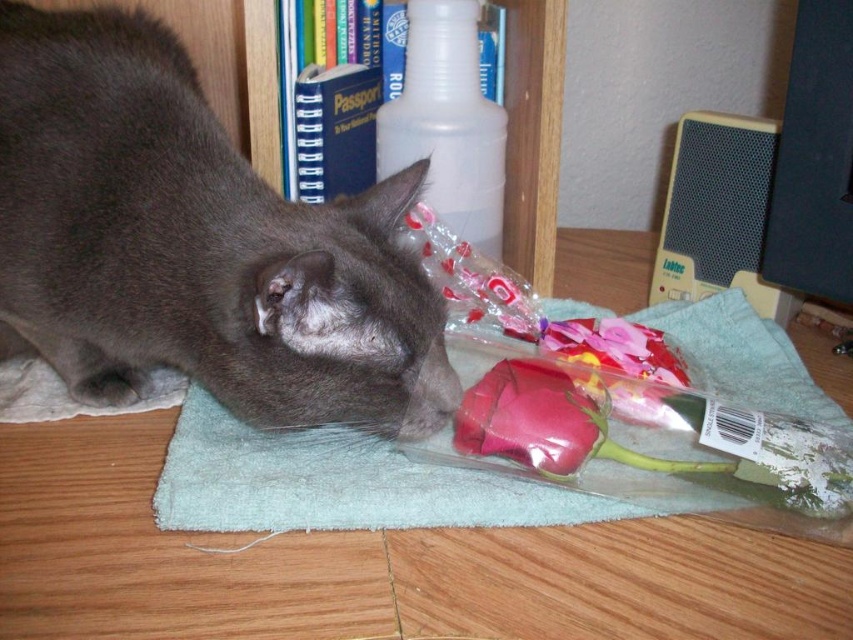
You are a photographer taking a closeup shot of the gray cat and the flower bouquet. You want to focus on the point at point (213, 170) and point (177, 433). Which point should you focus on first to ensure the cat is sharp in the photo?

Point (213, 170) should be focused on first because it is closer to the camera than point (177, 433), ensuring the cat appears sharp.

You are standing in the room where the gray fur cat at center and the wooden bookshelf at upper center are located. If you want to move from the cat to the bookshelf, in which direction should you move?

You should move to the right because the gray fur cat at center is to the left of the wooden bookshelf at upper center.

You are a delivery person who needs to place a transparent plastic bottle on the wooden bookshelf. The bottle must be placed at the exact coordinates of point (447, 122). Can you confirm if there is enough space at that location?

The point (447, 122) marks the location of a transparent plastic bottle at upper center, so placing another bottle there would not be possible as the space is already occupied.